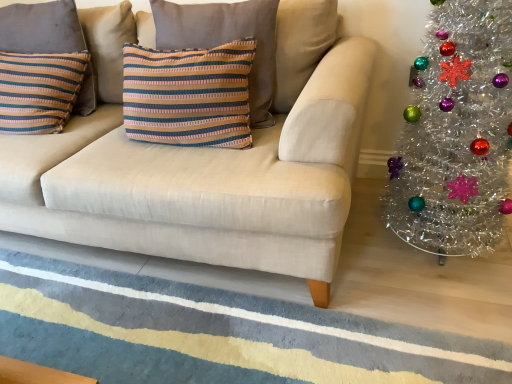
Question: Is striped fabric pillow at left, marked as the second pillow in a right-to-left arrangement, facing away from striped fabric pillow at center, the 2th pillow in the left-to-right sequence?

Choices:
 (A) yes
 (B) no

Answer: (B)

Question: From the image's perspective, is striped fabric pillow at left, marked as the second pillow in a right-to-left arrangement, under striped fabric pillow at center, the first pillow in the right-to-left sequence?

Choices:
 (A) no
 (B) yes

Answer: (A)

Question: Is striped fabric pillow at left, marked as the second pillow in a right-to-left arrangement, thinner than striped fabric pillow at center, the 2th pillow in the left-to-right sequence?

Choices:
 (A) yes
 (B) no

Answer: (A)

Question: Is striped fabric pillow at left, marked as the second pillow in a right-to-left arrangement, closer to camera compared to striped fabric pillow at center, the first pillow in the right-to-left sequence?

Choices:
 (A) yes
 (B) no

Answer: (B)

Question: Can you confirm if striped fabric pillow at left, marked as the second pillow in a right-to-left arrangement, is positioned to the right of striped fabric pillow at center, the first pillow in the right-to-left sequence?

Choices:
 (A) no
 (B) yes

Answer: (A)

Question: Is point (96, 21) closer or farther from the camera than point (48, 344)?

Choices:
 (A) closer
 (B) farther

Answer: (B)

Question: From a real-world perspective, relative to textured wool rug at lower center, is beige fabric couch at center vertically above or below?

Choices:
 (A) above
 (B) below

Answer: (A)

Question: Considering the positions of beige fabric couch at center and textured wool rug at lower center in the image, is beige fabric couch at center taller or shorter than textured wool rug at lower center?

Choices:
 (A) tall
 (B) short

Answer: (A)

Question: Would you say beige fabric couch at center is inside or outside textured wool rug at lower center?

Choices:
 (A) outside
 (B) inside

Answer: (A)

Question: From a real-world perspective, relative to tinsel silver christmas tree at right, is beige fabric couch at center vertically above or below?

Choices:
 (A) above
 (B) below

Answer: (A)

Question: In terms of height, does beige fabric couch at center look taller or shorter compared to tinsel silver christmas tree at right?

Choices:
 (A) short
 (B) tall

Answer: (A)

Question: Considering the positions of beige fabric couch at center and tinsel silver christmas tree at right in the image, is beige fabric couch at center wider or thinner than tinsel silver christmas tree at right?

Choices:
 (A) thin
 (B) wide

Answer: (B)

Question: Visually, is beige fabric couch at center positioned to the left or to the right of tinsel silver christmas tree at right?

Choices:
 (A) left
 (B) right

Answer: (A)

Question: Is beige fabric couch at center wider or thinner than striped fabric pillow at left, marked as the second pillow in a right-to-left arrangement?

Choices:
 (A) wide
 (B) thin

Answer: (A)

Question: Is point (287, 134) positioned closer to the camera than point (70, 14)?

Choices:
 (A) farther
 (B) closer

Answer: (B)